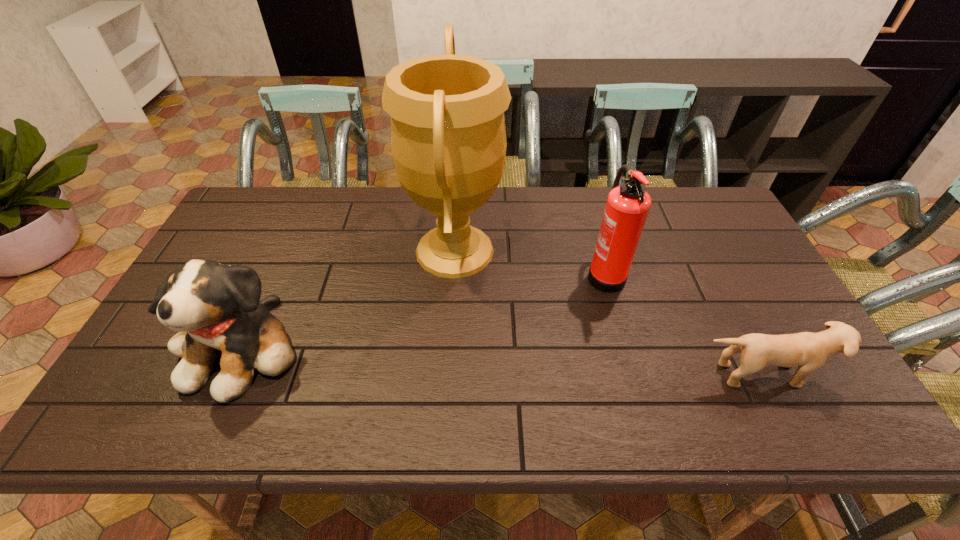
You are a GUI agent. You are given a task and a screenshot of the screen. Output one action in this format:
    pyautogui.click(x=<x>, y=<y>)
    Task: Click on the trophy
    Image resolution: width=960 pixels, height=540 pixels.
    Given the screenshot: What is the action you would take?
    click(448, 137)

Where is `the tallest object`? The width and height of the screenshot is (960, 540). the tallest object is located at coordinates (448, 137).

The width and height of the screenshot is (960, 540). I want to click on the second object from right to left, so click(x=627, y=207).

At what (x,y) coordinates should I click in order to perform the action: click on fire extinguisher. Please return your answer as a coordinate pair (x, y). Image resolution: width=960 pixels, height=540 pixels. Looking at the image, I should click on [x=627, y=207].

Where is `the third tallest object`? This screenshot has height=540, width=960. the third tallest object is located at coordinates (216, 309).

The width and height of the screenshot is (960, 540). I want to click on the leftmost object, so click(x=216, y=309).

Image resolution: width=960 pixels, height=540 pixels. I want to click on the shortest object, so click(809, 351).

What are the coordinates of `the rightmost object` in the screenshot? It's located at (809, 351).

The image size is (960, 540). I want to click on free point located on the engravings side of the third object from right to left, so click(534, 251).

Find the location of a particular element. vacant region located at the nozzle of the third shortest object is located at coordinates (555, 273).